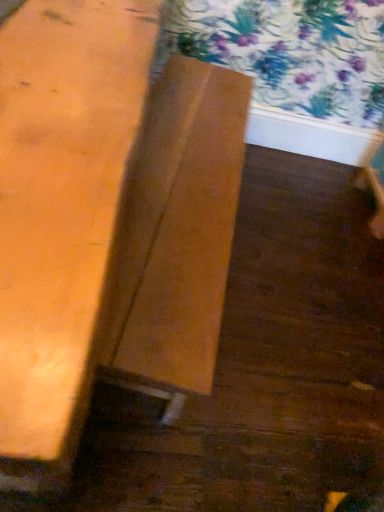
You are a GUI agent. You are given a task and a screenshot of the screen. Output one action in this format:
    pyautogui.click(x=<x>, y=<y>)
    Task: Click on the free space above wooden table at center (from a real-world perspective)
    This screenshot has width=384, height=512.
    Given the screenshot: What is the action you would take?
    point(186,156)